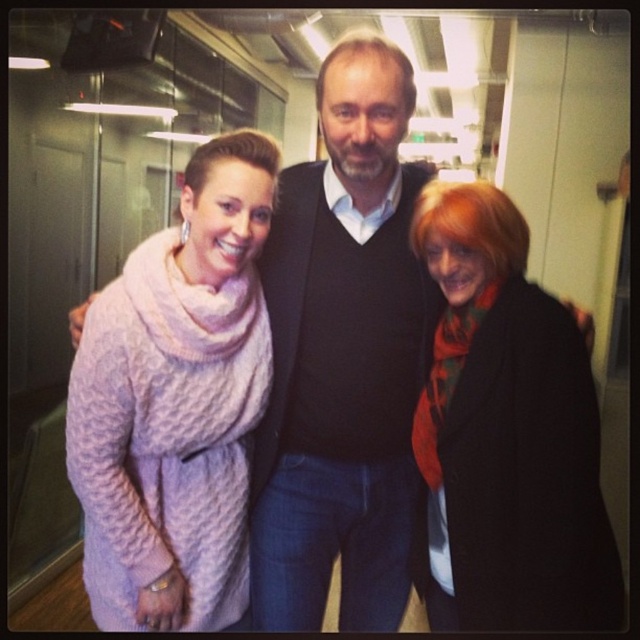
Is point (328, 426) farther from viewer compared to point (163, 342)?

That is True.

Can you confirm if dark gray sweater at center is shorter than cable-knit sweater at center?

No.

At what (x,y) coordinates should I click in order to perform the action: click on dark gray sweater at center. Please return your answer as a coordinate pair (x, y). Looking at the image, I should click on (342, 358).

Where is `dark gray sweater at center`? Image resolution: width=640 pixels, height=640 pixels. dark gray sweater at center is located at coordinates (342, 358).

What do you see at coordinates (342, 358) in the screenshot?
I see `dark gray sweater at center` at bounding box center [342, 358].

Does dark gray sweater at center have a larger size compared to orange scarf at right?

Indeed, dark gray sweater at center has a larger size compared to orange scarf at right.

Is point (266, 244) positioned in front of point (440, 188)?

No, it is not.

This screenshot has width=640, height=640. Find the location of `dark gray sweater at center`. dark gray sweater at center is located at coordinates (342, 358).

Is cable-knit sweater at center shorter than orange scarf at right?

No.

Is cable-knit sweater at center to the right of orange scarf at right from the viewer's perspective?

No, cable-knit sweater at center is not to the right of orange scarf at right.

Which is behind, point (202, 396) or point (500, 304)?

The point (202, 396) is behind.

The width and height of the screenshot is (640, 640). Identify the location of cable-knit sweater at center. tap(177, 397).